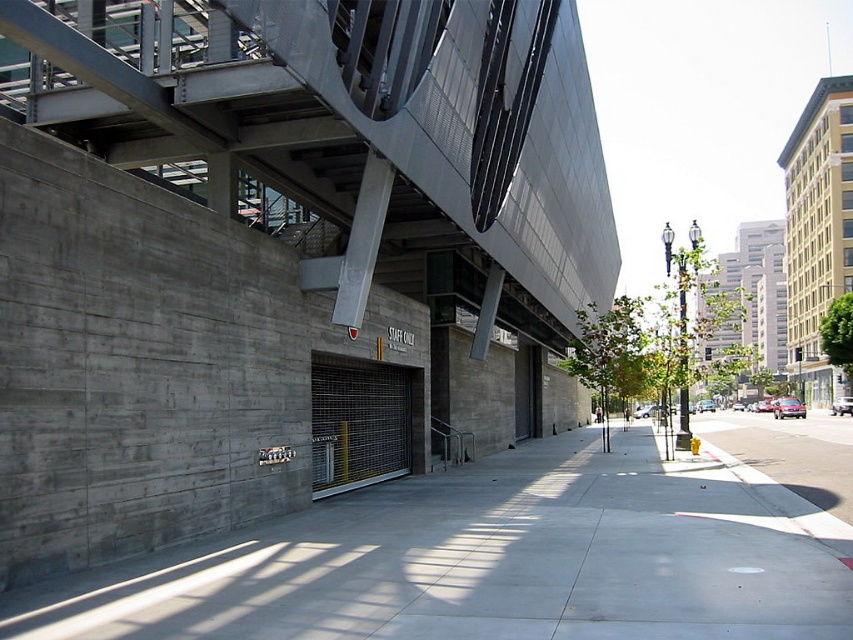
Question: Is metallic gray overpass at center bigger than gray concrete sidewalk at center?

Choices:
 (A) no
 (B) yes

Answer: (B)

Question: Considering the relative positions of metallic gray overpass at center and gray concrete sidewalk at center in the image provided, where is metallic gray overpass at center located with respect to gray concrete sidewalk at center?

Choices:
 (A) left
 (B) right

Answer: (A)

Question: Among these objects, which one is farthest from the camera?

Choices:
 (A) gray concrete sidewalk at center
 (B) metallic gray overpass at center

Answer: (B)

Question: Among these objects, which one is nearest to the camera?

Choices:
 (A) metallic gray overpass at center
 (B) gray concrete sidewalk at center

Answer: (B)

Question: Does metallic gray overpass at center have a lesser width compared to gray concrete sidewalk at center?

Choices:
 (A) yes
 (B) no

Answer: (B)